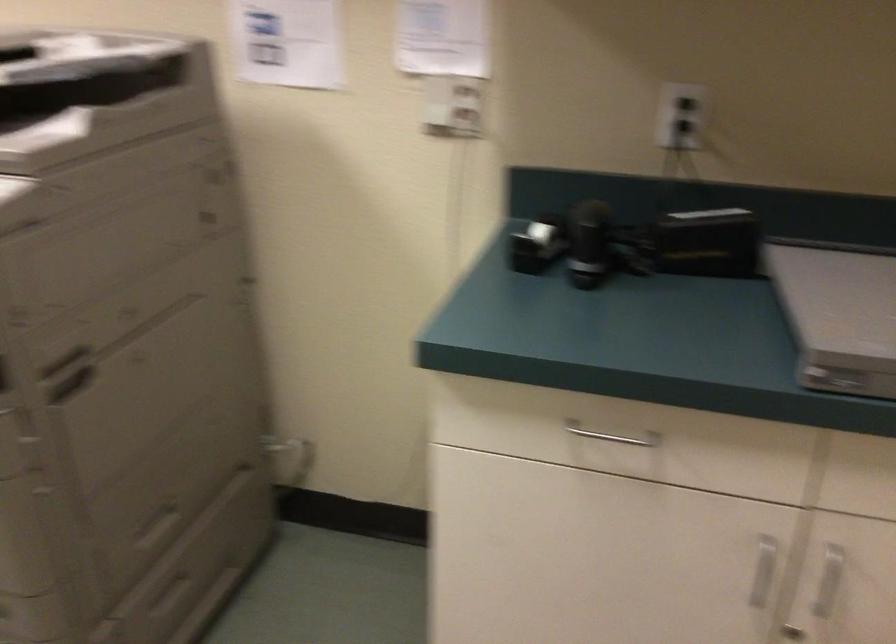
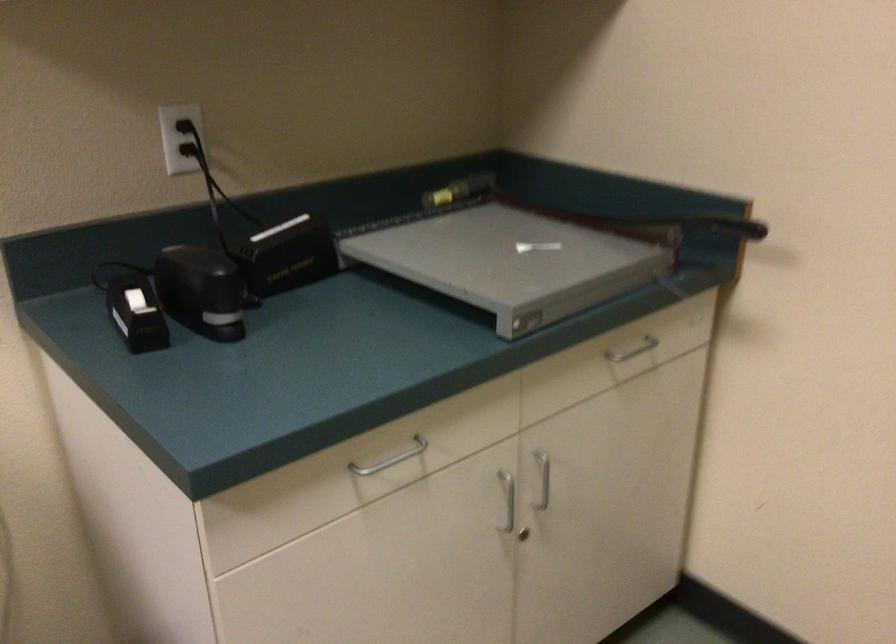
In the second image, find the point that corresponds to point (781, 571) in the first image.

(507, 500)